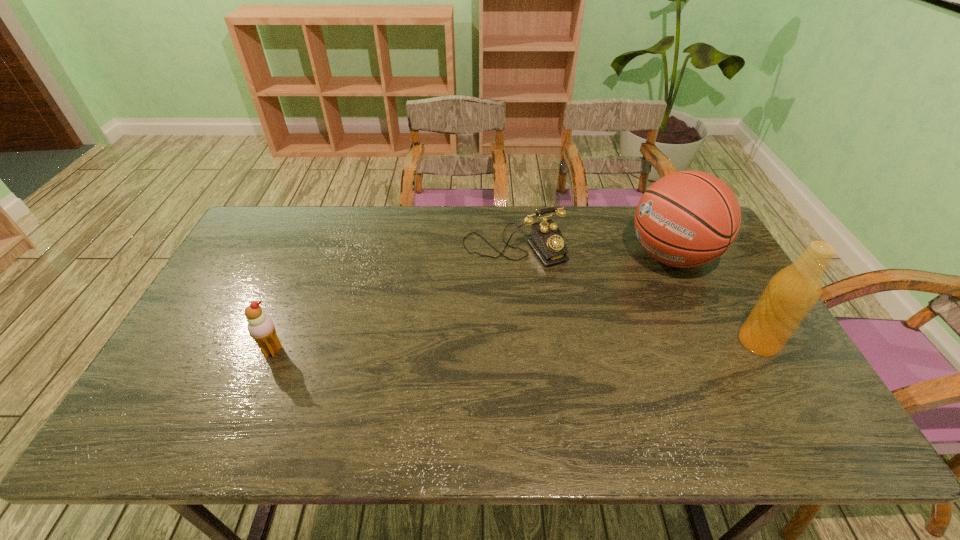
This screenshot has width=960, height=540. In order to click on icecream in this screenshot , I will do `click(260, 326)`.

This screenshot has width=960, height=540. I want to click on the leftmost object, so coord(260,326).

Locate an element on the screen. The width and height of the screenshot is (960, 540). beer bottle is located at coordinates (792, 292).

This screenshot has width=960, height=540. What are the coordinates of `the third object from right to left` in the screenshot? It's located at (546, 239).

Identify the location of telephone. This screenshot has width=960, height=540. (546, 239).

Image resolution: width=960 pixels, height=540 pixels. Find the location of `basketball`. basketball is located at coordinates (686, 219).

Locate an element on the screen. Image resolution: width=960 pixels, height=540 pixels. vacant point located 0.110m at the front with a straw on the icecream is located at coordinates (253, 398).

Where is `vacant space situated on the left of the beer bottle`? Image resolution: width=960 pixels, height=540 pixels. vacant space situated on the left of the beer bottle is located at coordinates tap(596, 342).

In order to click on vacant space located on the dial of the third object from right to left in this screenshot , I will do `click(591, 349)`.

In order to click on free location located on the dial of the third object from right to left in this screenshot , I will do `click(582, 335)`.